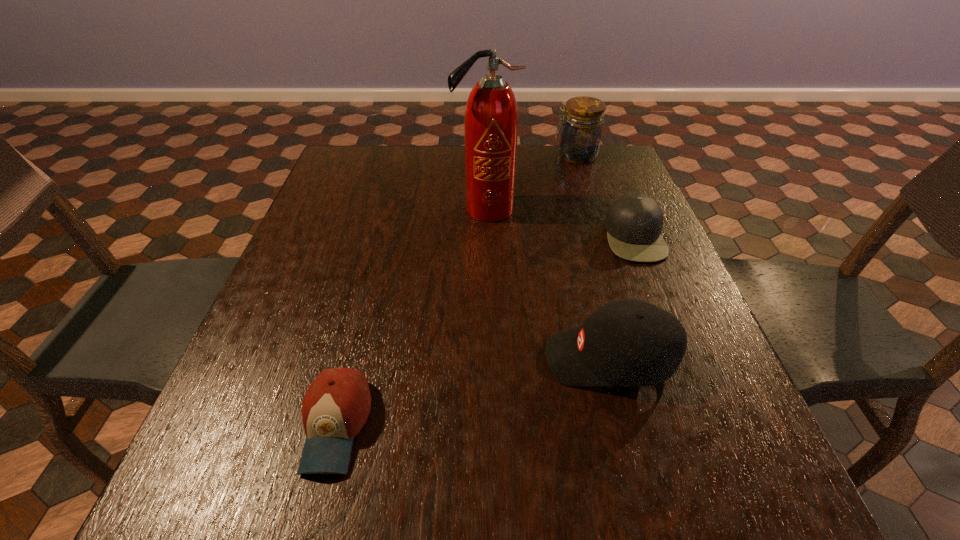
Find the location of a particular element. The height and width of the screenshot is (540, 960). fire extinguisher is located at coordinates (491, 118).

At what (x,y) coordinates should I click in order to perform the action: click on the fourth object from right to left. Please return your answer as a coordinate pair (x, y). The height and width of the screenshot is (540, 960). Looking at the image, I should click on click(491, 118).

You are a GUI agent. You are given a task and a screenshot of the screen. Output one action in this format:
    pyautogui.click(x=<x>, y=<y>)
    Task: Click on the fourth shortest object
    This screenshot has width=960, height=540.
    Given the screenshot: What is the action you would take?
    pyautogui.click(x=581, y=133)

At what (x,y) coordinates should I click in order to perform the action: click on jar. Please return your answer as a coordinate pair (x, y). This screenshot has height=540, width=960. Looking at the image, I should click on (581, 133).

The image size is (960, 540). I want to click on the taller baseball cap, so click(x=632, y=343).

You are a GUI agent. You are given a task and a screenshot of the screen. Output one action in this format:
    pyautogui.click(x=<x>, y=<y>)
    Task: Click on the third shortest object
    This screenshot has height=540, width=960.
    Given the screenshot: What is the action you would take?
    pyautogui.click(x=632, y=343)

I want to click on cap, so click(x=634, y=222).

Where is `the leftmost object`? The image size is (960, 540). the leftmost object is located at coordinates (336, 406).

Identify the location of the left baseball cap. This screenshot has width=960, height=540. click(x=336, y=406).

This screenshot has width=960, height=540. Find the location of `free space located on the front of the fourth object from right to left`. free space located on the front of the fourth object from right to left is located at coordinates (488, 333).